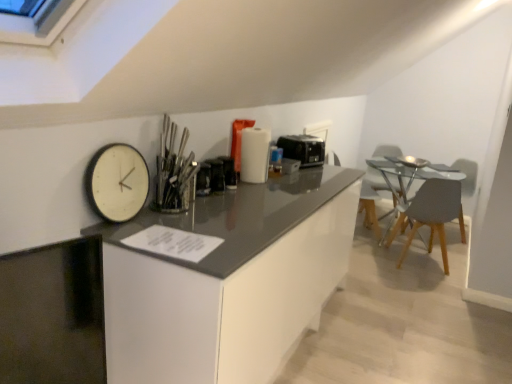
Locate an element on the screen. The height and width of the screenshot is (384, 512). free space that is in between white matte clock at left and polished metal utensils at center is located at coordinates (138, 224).